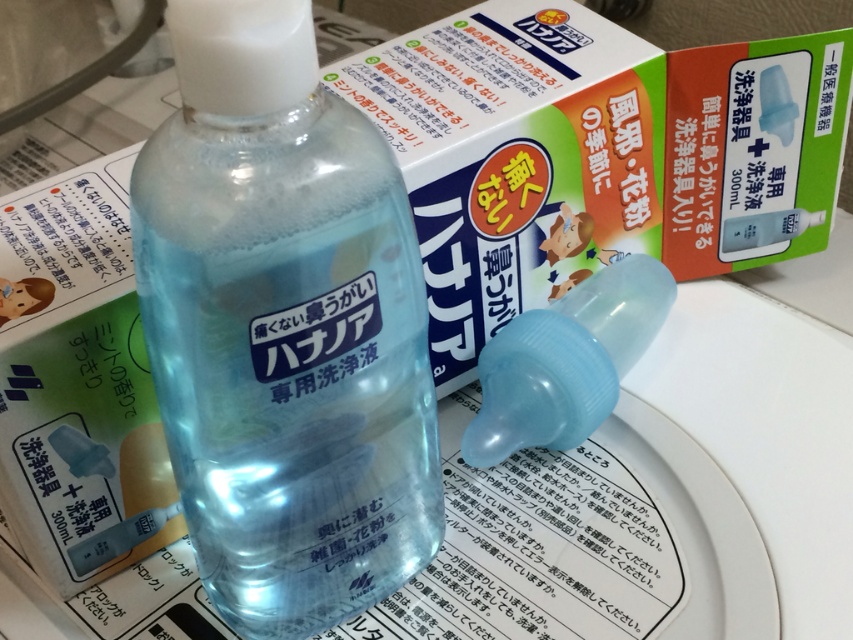
Question: Which point is closer to the camera?

Choices:
 (A) transparent plastic nasal spray at center
 (B) transparent plastic bottle at center

Answer: (B)

Question: Is transparent plastic bottle at center bigger than transparent plastic nasal spray at center?

Choices:
 (A) yes
 (B) no

Answer: (A)

Question: Which point appears closest to the camera in this image?

Choices:
 (A) (x=515, y=339)
 (B) (x=248, y=320)

Answer: (B)

Question: Which point is closer to the camera?

Choices:
 (A) transparent plastic nasal spray at center
 (B) transparent plastic bottle at center

Answer: (B)

Question: In this image, where is transparent plastic bottle at center located relative to transparent plastic nasal spray at center?

Choices:
 (A) above
 (B) below

Answer: (A)

Question: Can you confirm if transparent plastic bottle at center is bigger than transparent plastic nasal spray at center?

Choices:
 (A) no
 (B) yes

Answer: (B)